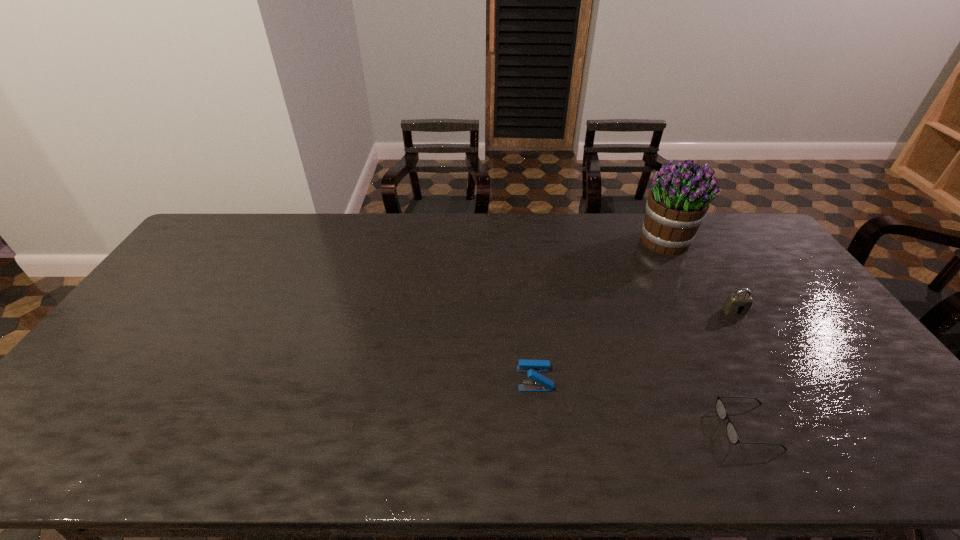
Locate an element on the screen. Image resolution: width=960 pixels, height=540 pixels. blank space located on the front of the third farthest object is located at coordinates (539, 417).

Image resolution: width=960 pixels, height=540 pixels. Identify the location of vacant area situated on the front-facing side of the nearest object. (608, 427).

Identify the location of free space located 0.190m on the front-facing side of the nearest object. (641, 427).

Image resolution: width=960 pixels, height=540 pixels. What are the coordinates of `free space located 0.060m on the front-facing side of the nearest object` in the screenshot? It's located at (697, 427).

This screenshot has width=960, height=540. In order to click on object that is at the far edge in this screenshot , I will do `click(677, 203)`.

This screenshot has width=960, height=540. In order to click on object present at the near edge in this screenshot , I will do `click(732, 434)`.

In the image, there is a desktop. Identify the location of free space at the far edge. (552, 216).

The width and height of the screenshot is (960, 540). In order to click on vacant space at the left edge in this screenshot , I will do `click(162, 332)`.

Find the location of a particular element. This screenshot has height=540, width=960. vacant space at the right edge of the desktop is located at coordinates (808, 299).

This screenshot has width=960, height=540. I want to click on vacant space at the near right corner, so click(x=885, y=453).